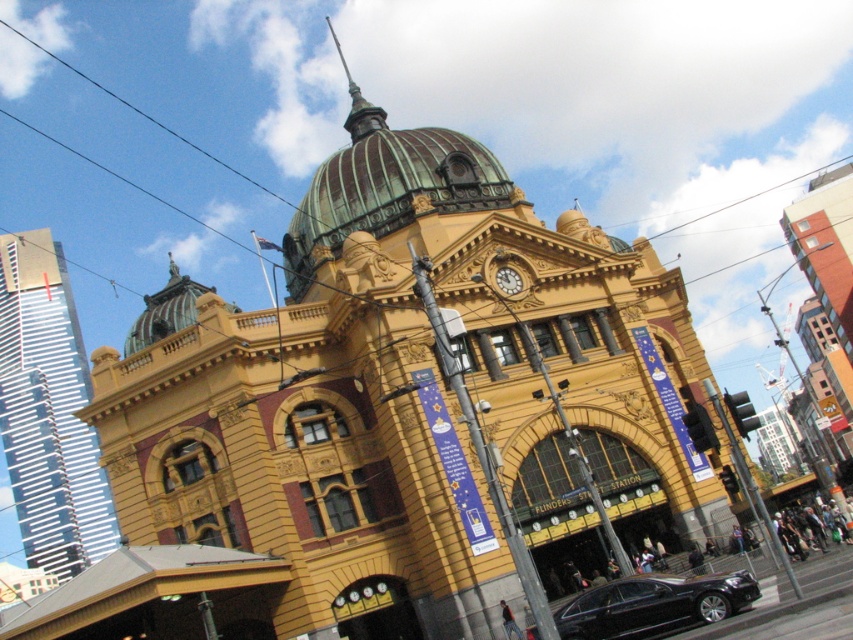
You are a city planner assessing the skyline. Given the white glass skyscraper at left and the green glass dome at upper center, which one appears taller in the image?

The white glass skyscraper at left is much taller than the green glass dome at upper center, so it appears taller in the image.

You are standing in front of the historic train station and see two points marked on the facade. The first point is at coordinate point (599, 589) and the second is at point (514, 285). Which point is closer to you?

Point (599, 589) is in front of point (514, 285), so the first point is closer to you.